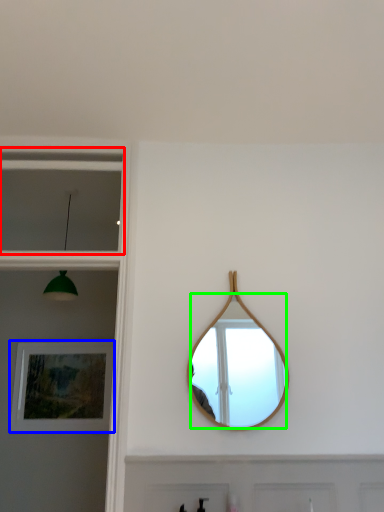
Question: Which is nearer to the window (highlighted by a red box)? picture frame (highlighted by a blue box) or mirror (highlighted by a green box).

Choices:
 (A) picture frame
 (B) mirror

Answer: (A)